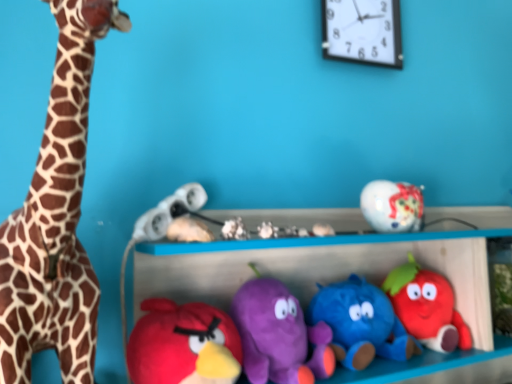
Question: Looking at their shapes, would you say spotted fur giraffe at left is wider or thinner than white plastic clock at upper center?

Choices:
 (A) wide
 (B) thin

Answer: (A)

Question: Does point (48, 226) appear closer or farther from the camera than point (358, 11)?

Choices:
 (A) closer
 (B) farther

Answer: (A)

Question: Which object is the closest to the soft plush strawberry at center right, the 1th toy viewed from the right?

Choices:
 (A) white plush toy at center, marked as the sixth toy in a right-to-left arrangement
 (B) white plastic clock at upper center
 (C) matte white toy at center, which ranks as the 8th toy in right-to-left order
 (D) velvet plush bird at lower left, arranged as the seventh toy when viewed from the right
 (E) spotted fur giraffe at left

Answer: (A)

Question: Which object is positioned farthest from the white matte headphones at center, which ranks as the first toy in left-to-right order?

Choices:
 (A) white plush toy at center, the fourth toy in the left-to-right sequence
 (B) blue plush toy at center, positioned as the second toy in right-to-left order
 (C) velvet plush bird at lower left, arranged as the seventh toy when viewed from the right
 (D) matte white toy at center, which ranks as the second toy in left-to-right order
 (E) soft plush strawberry at center right, the 1th toy viewed from the right

Answer: (E)